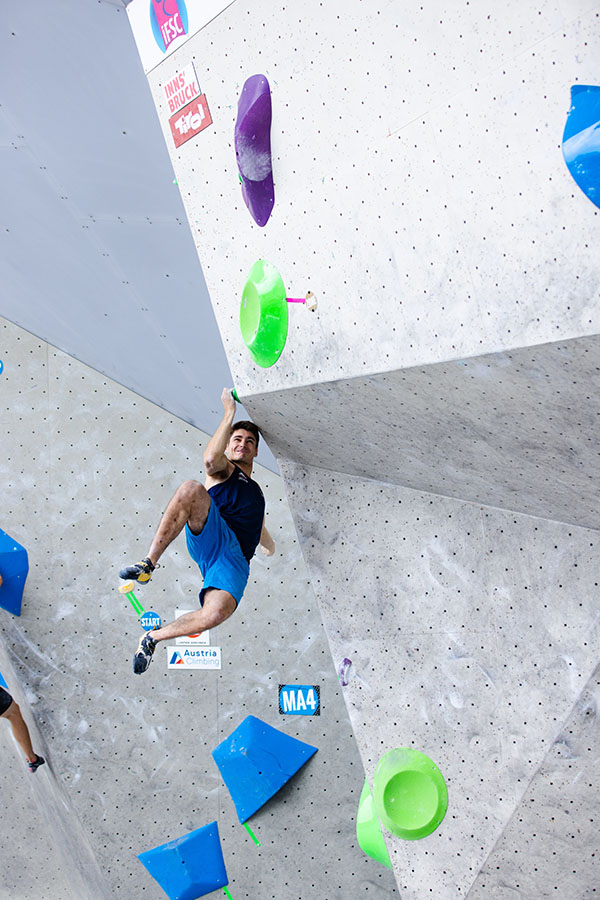
Find the location of a particular element. shoe is located at coordinates (144, 646), (135, 572), (33, 765).